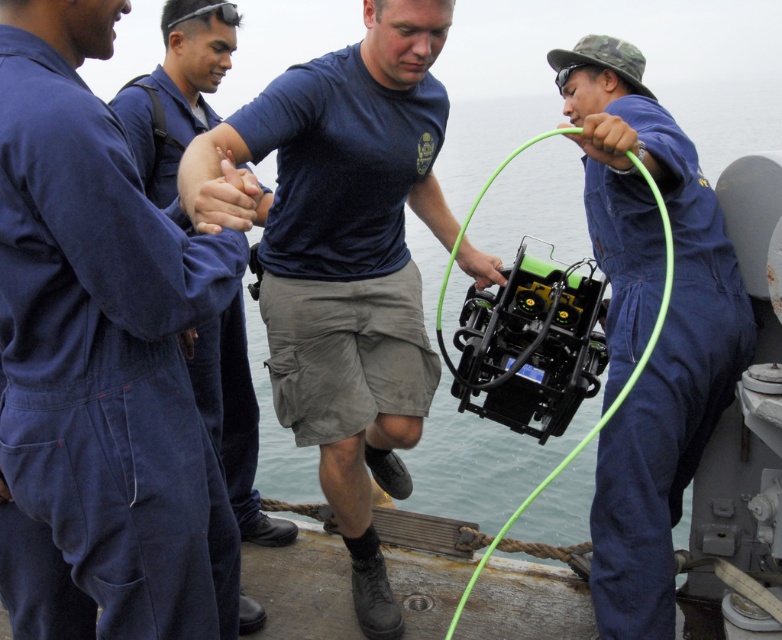
Is point (612, 252) positioned in front of point (176, 8)?

Yes, it is in front of point (176, 8).

Which is more to the left, blue coveralls at right or matte blue jumpsuit at center?

matte blue jumpsuit at center is more to the left.

Who is more distant from viewer, (623, 428) or (205, 35)?

The point (205, 35) is behind.

Locate an element on the screen. The image size is (782, 640). blue coveralls at right is located at coordinates (648, 326).

Who is lower down, dark blue t-shirt at center or matte blue jumpsuit at center?

matte blue jumpsuit at center

Can you confirm if dark blue t-shirt at center is positioned below matte blue jumpsuit at center?

No.

Where is `dark blue t-shirt at center`? This screenshot has height=640, width=782. dark blue t-shirt at center is located at coordinates (346, 259).

Locate an element on the screen. The height and width of the screenshot is (640, 782). dark blue t-shirt at center is located at coordinates (346, 259).

Does dark blue t-shirt at center appear on the right side of blue coveralls at right?

In fact, dark blue t-shirt at center is to the left of blue coveralls at right.

Which is in front, point (325, 368) or point (684, 211)?

Point (684, 211) is more forward.

The image size is (782, 640). I want to click on dark blue t-shirt at center, so click(x=346, y=259).